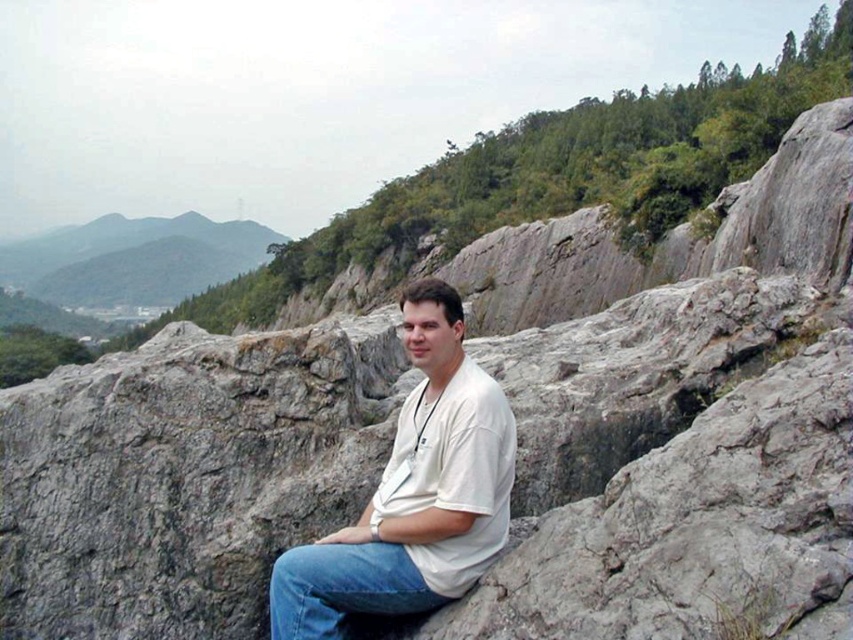
Is white matte shirt at center to the right of green grassy hill at upper left from the viewer's perspective?

Yes, white matte shirt at center is to the right of green grassy hill at upper left.

Image resolution: width=853 pixels, height=640 pixels. Describe the element at coordinates (413, 492) in the screenshot. I see `white matte shirt at center` at that location.

What do you see at coordinates (413, 492) in the screenshot? I see `white matte shirt at center` at bounding box center [413, 492].

At what (x,y) coordinates should I click in order to perform the action: click on white matte shirt at center. Please return your answer as a coordinate pair (x, y). The width and height of the screenshot is (853, 640). Looking at the image, I should click on (413, 492).

Does white matte shirt at center come in front of denim at center?

No, white matte shirt at center is behind denim at center.

What do you see at coordinates (413, 492) in the screenshot? I see `white matte shirt at center` at bounding box center [413, 492].

I want to click on white matte shirt at center, so click(x=413, y=492).

The height and width of the screenshot is (640, 853). What do you see at coordinates (132, 259) in the screenshot? I see `green grassy hill at upper left` at bounding box center [132, 259].

Locate an element on the screen. green grassy hill at upper left is located at coordinates (132, 259).

Between point (84, 275) and point (372, 547), which one is positioned in front?

Positioned in front is point (372, 547).

I want to click on green grassy hill at upper left, so click(x=132, y=259).